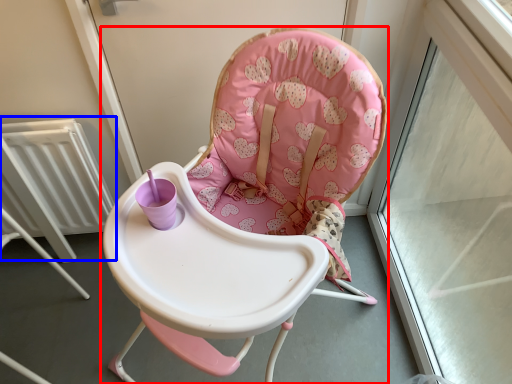
Question: Which of the following is the farthest to the observer, chair (highlighted by a red box) or radiator (highlighted by a blue box)?

Choices:
 (A) chair
 (B) radiator

Answer: (B)